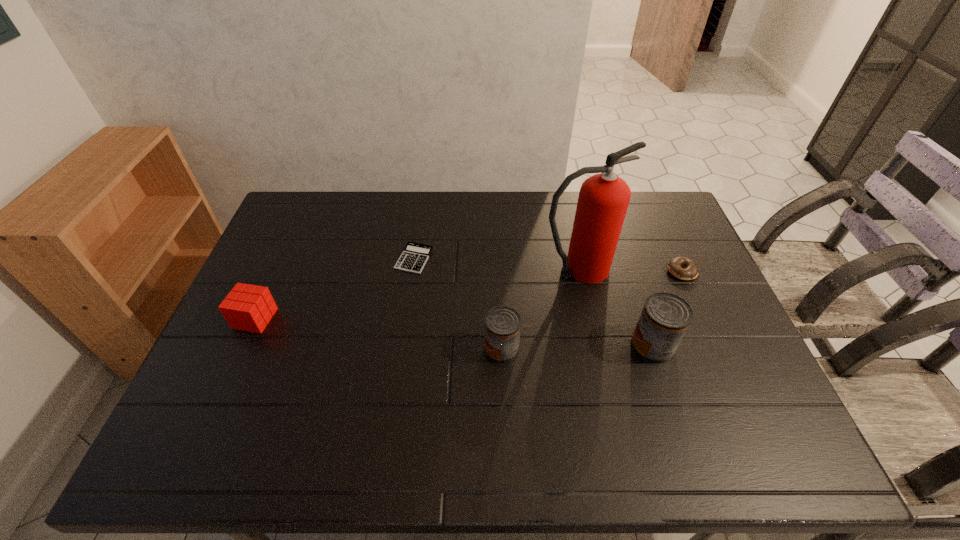
I want to click on free spot between the doughnut and the calculator, so click(x=548, y=265).

The image size is (960, 540). I want to click on free point between the tallest object and the doughnut, so click(x=629, y=270).

Identify which object is the third closest to the tallest object. Please provide its 2D coordinates. Your answer should be formatted as a tuple, i.e. [(x, y)], where the tuple contains the x and y coordinates of a point satisfying the conditions above.

[(502, 325)]

The height and width of the screenshot is (540, 960). Identify the location of the fifth closest object to the tallest object. (247, 307).

Where is `vacant position in the image that satisfies the following two spatial constraints: 1. on the back side of the fourth tallest object; 2. on the right side of the rightmost object`? vacant position in the image that satisfies the following two spatial constraints: 1. on the back side of the fourth tallest object; 2. on the right side of the rightmost object is located at coordinates (276, 272).

Locate an element on the screen. free region that satisfies the following two spatial constraints: 1. on the handle side of the fire extinguisher; 2. on the right side of the doughnut is located at coordinates (577, 272).

Identify the location of free point that satisfies the following two spatial constraints: 1. on the back side of the fourth object from right to left; 2. on the right side of the doughnut. This screenshot has height=540, width=960. (498, 272).